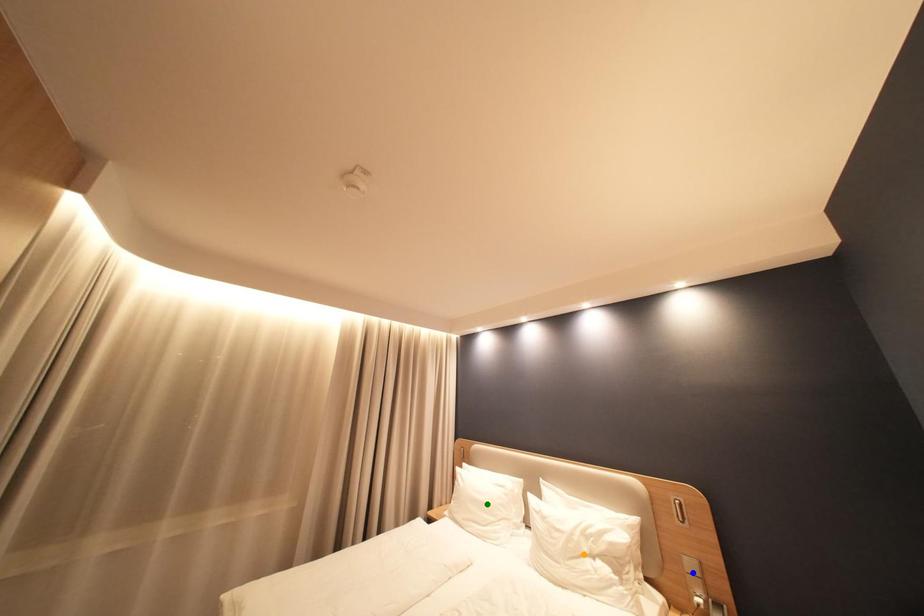
Order these from nearest to farthest:
1. green point
2. orange point
3. blue point

blue point
orange point
green point